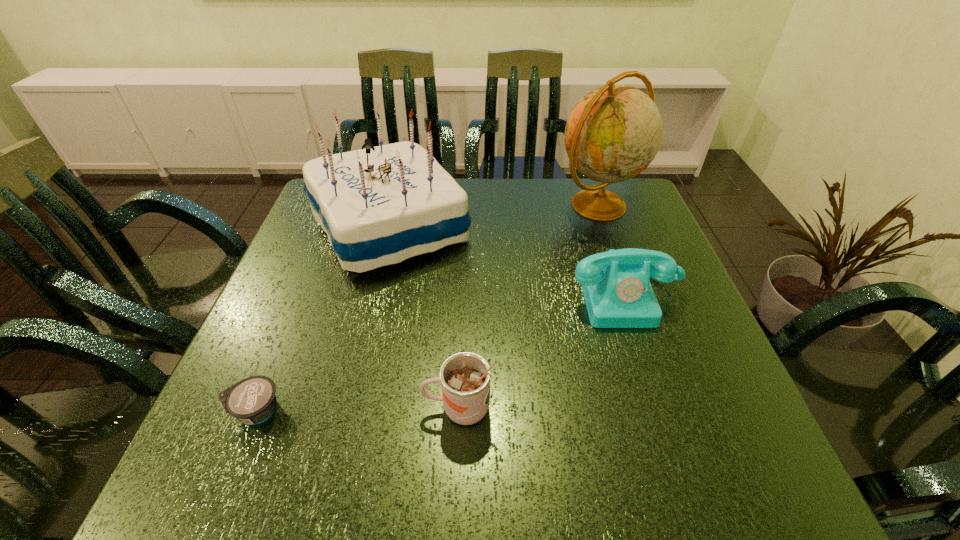
Where is `free space located on the side with the handle of the cup`? free space located on the side with the handle of the cup is located at coordinates (261, 408).

Locate an element on the screen. vacant space located 0.380m on the right of the shortest object is located at coordinates (503, 410).

This screenshot has width=960, height=540. In order to click on globe that is at the far edge in this screenshot , I will do `click(613, 133)`.

Locate an element on the screen. The image size is (960, 540). birthday cake that is at the far edge is located at coordinates (381, 205).

This screenshot has width=960, height=540. In order to click on birthday cake situated at the left edge in this screenshot , I will do `click(381, 205)`.

The width and height of the screenshot is (960, 540). What are the coordinates of `yogurt located in the left edge section of the desktop` in the screenshot? It's located at (252, 400).

Image resolution: width=960 pixels, height=540 pixels. Find the location of `globe located at the right edge`. globe located at the right edge is located at coordinates (613, 133).

In order to click on telephone located in the right edge section of the desktop in this screenshot , I will do `click(616, 286)`.

Locate an element on the screen. object present at the far left corner is located at coordinates pyautogui.click(x=381, y=205).

This screenshot has height=540, width=960. What are the coordinates of `object that is positioned at the far right corner` in the screenshot? It's located at (613, 133).